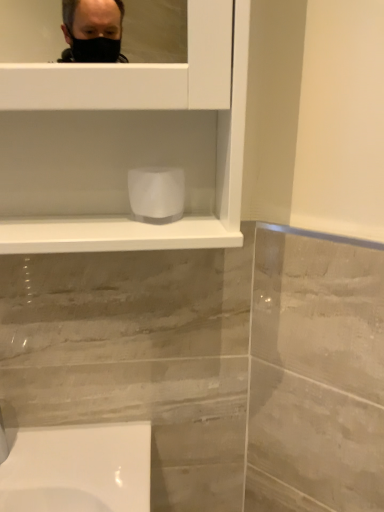
Based on the photo, in order to face matte silver faucet at lower left, should I rotate leftwards or rightwards?

A 26.646 degree turn to the left will do.

What do you see at coordinates (7, 429) in the screenshot?
I see `matte silver faucet at lower left` at bounding box center [7, 429].

Identify the location of matte silver faucet at lower left. The height and width of the screenshot is (512, 384). (7, 429).

Measure the distance between point (x=142, y=218) and camera.

A distance of 25.31 inches exists between point (x=142, y=218) and camera.

What is the approximate width of white matte toilet paper at center?

2.39 inches.

This screenshot has width=384, height=512. I want to click on white matte toilet paper at center, so click(156, 194).

This screenshot has width=384, height=512. Describe the element at coordinates (156, 194) in the screenshot. I see `white matte toilet paper at center` at that location.

The image size is (384, 512). What are the coordinates of `matte silver faucet at lower left` in the screenshot? It's located at (7, 429).

Considering the positions of objects matte silver faucet at lower left and white matte toilet paper at center in the image provided, who is more to the left, matte silver faucet at lower left or white matte toilet paper at center?

From the viewer's perspective, matte silver faucet at lower left appears more on the left side.

Consider the image. Considering the positions of objects matte silver faucet at lower left and white matte toilet paper at center in the image provided, who is behind, matte silver faucet at lower left or white matte toilet paper at center?

Positioned behind is white matte toilet paper at center.

Is point (11, 447) positioned in front of point (157, 205)?

No, it is not.

From the image's perspective, which is below, matte silver faucet at lower left or white matte toilet paper at center?

matte silver faucet at lower left appears lower in the image.

From a real-world perspective, is matte silver faucet at lower left physically above white matte toilet paper at center?

Actually, matte silver faucet at lower left is physically below white matte toilet paper at center in the real world.

Which object is wider, matte silver faucet at lower left or white matte toilet paper at center?

Wider between the two is matte silver faucet at lower left.

Considering the relative sizes of matte silver faucet at lower left and white matte toilet paper at center in the image provided, is matte silver faucet at lower left taller than white matte toilet paper at center?

Yes.

Considering the sizes of objects matte silver faucet at lower left and white matte toilet paper at center in the image provided, who is bigger, matte silver faucet at lower left or white matte toilet paper at center?

With larger size is matte silver faucet at lower left.

Is matte silver faucet at lower left situated inside white matte toilet paper at center or outside?

matte silver faucet at lower left is outside white matte toilet paper at center.

From the picture: Is the surface of matte silver faucet at lower left in direct contact with white matte toilet paper at center?

matte silver faucet at lower left and white matte toilet paper at center are not in contact.

Could you tell me if matte silver faucet at lower left is turned towards white matte toilet paper at center?

No.

Measure the distance between matte silver faucet at lower left and white matte toilet paper at center.

They are 19.29 inches apart.

Where is `faucet lying below the white matte toilet paper at center (from the image's perspective)`? faucet lying below the white matte toilet paper at center (from the image's perspective) is located at coordinates (7, 429).

Between white matte toilet paper at center and matte silver faucet at lower left, which one appears on the left side from the viewer's perspective?

matte silver faucet at lower left is more to the left.

Relative to matte silver faucet at lower left, is white matte toilet paper at center in front or behind?

In the image, white matte toilet paper at center appears behind matte silver faucet at lower left.

Is point (139, 183) farther from camera compared to point (8, 446)?

No, (139, 183) is closer to viewer.

From the image's perspective, does white matte toilet paper at center appear higher than matte silver faucet at lower left?

Indeed, from the image's perspective, white matte toilet paper at center is shown above matte silver faucet at lower left.

From a real-world perspective, which object rests below the other?

matte silver faucet at lower left is physically lower.

Looking at their sizes, would you say white matte toilet paper at center is wider or thinner than matte silver faucet at lower left?

Clearly, white matte toilet paper at center has less width compared to matte silver faucet at lower left.

From the picture: Is white matte toilet paper at center shorter than matte silver faucet at lower left?

Yes.

Considering the relative sizes of white matte toilet paper at center and matte silver faucet at lower left in the image provided, is white matte toilet paper at center smaller than matte silver faucet at lower left?

Yes.

Is white matte toilet paper at center situated inside matte silver faucet at lower left or outside?

white matte toilet paper at center is spatially situated outside matte silver faucet at lower left.

Is the surface of white matte toilet paper at center in direct contact with matte silver faucet at lower left?

No, white matte toilet paper at center is not with matte silver faucet at lower left.

Is white matte toilet paper at center facing towards matte silver faucet at lower left?

No, white matte toilet paper at center is not oriented towards matte silver faucet at lower left.

Can you tell me how much white matte toilet paper at center and matte silver faucet at lower left differ in facing direction?

The angle between the facing direction of white matte toilet paper at center and the facing direction of matte silver faucet at lower left is 1.19 degrees.

The height and width of the screenshot is (512, 384). Identify the location of faucet lying below the white matte toilet paper at center (from the image's perspective). (7, 429).

The width and height of the screenshot is (384, 512). Find the location of `toilet paper above the matte silver faucet at lower left (from the image's perspective)`. toilet paper above the matte silver faucet at lower left (from the image's perspective) is located at coordinates (156, 194).

I want to click on faucet below the white matte toilet paper at center (from a real-world perspective), so click(7, 429).